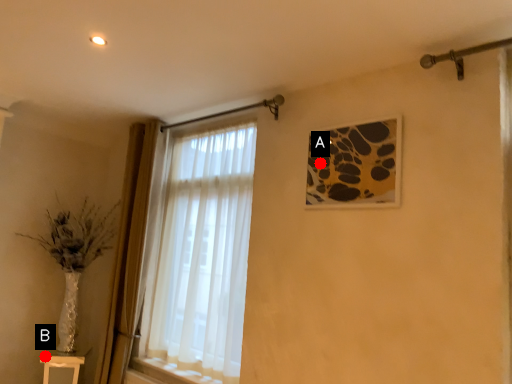
Question: Two points are circled on the image, labeled by A and B beside each circle. Which point is closer to the camera?

Choices:
 (A) A is closer
 (B) B is closer

Answer: (A)